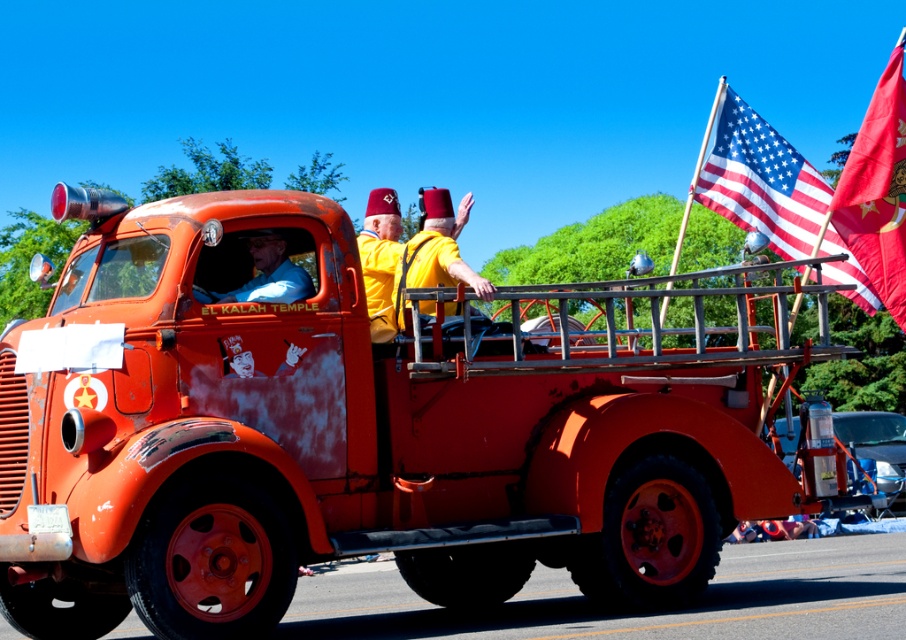
Consider the image. You are a photographer standing at the back of the crowd, trying to capture both the red fabric flag at upper right and the matte yellow shirt at center in a single photo. Given that your camera has a maximum focus range of 5 meters, will you be able to include both subjects in the same frame without moving closer?

The red fabric flag at upper right and matte yellow shirt at center are 4.91 meters apart from each other. Since the distance between them is within the camera maximum focus range of 5 meters, you can capture both subjects in the same frame without moving closer.

You are a photographer standing at the origin point of the image coordinate system. You want to capture a photo of the rusty orange fire truck at center. What are the coordinates of the fire truck?

The coordinates of the rusty orange fire truck at center are at point (353, 433).

You are a photographer at the event and want to capture a clear photo of both the yellow matte fez at center and the matte yellow shirt at center. Which object should you focus on first to ensure it appears sharp in the photo?

The yellow matte fez at center is thinner than the matte yellow shirt at center, so you should focus on the yellow matte fez at center first to ensure its finer details are captured sharply.